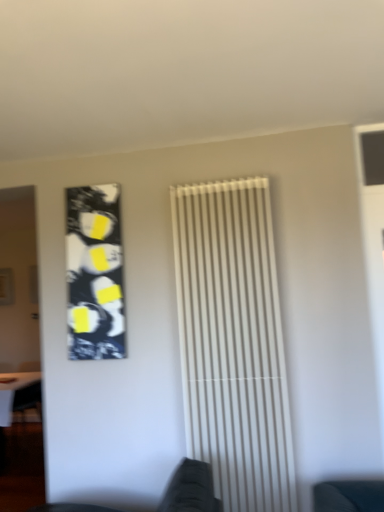
Image resolution: width=384 pixels, height=512 pixels. In order to click on white glossy table at lower left in this screenshot , I will do `click(18, 394)`.

The height and width of the screenshot is (512, 384). What do you see at coordinates (95, 273) in the screenshot? I see `black and white abstract art at upper left` at bounding box center [95, 273].

Image resolution: width=384 pixels, height=512 pixels. What are the coordinates of `white matte radiator at center` in the screenshot? It's located at pos(233,342).

Where is `poster that appears in front of the white glossy table at lower left`? poster that appears in front of the white glossy table at lower left is located at coordinates (95, 273).

Can you see black and white abstract art at upper left touching white glossy table at lower left?

No, black and white abstract art at upper left is not with white glossy table at lower left.

Which of these two, black and white abstract art at upper left or white glossy table at lower left, stands taller?

Standing taller between the two is black and white abstract art at upper left.

Would you say black and white abstract art at upper left is to the left or to the right of white glossy table at lower left in the picture?

Clearly, black and white abstract art at upper left is on the right of white glossy table at lower left in the image.

Based on the photo, is white glossy table at lower left surrounded by white matte radiator at center?

No, white glossy table at lower left is located outside of white matte radiator at center.

Is point (258, 336) closer or farther from the camera than point (5, 423)?

Point (258, 336) is positioned closer to the camera compared to point (5, 423).

Considering the relative sizes of white matte radiator at center and white glossy table at lower left in the image provided, is white matte radiator at center taller than white glossy table at lower left?

Yes, white matte radiator at center is taller than white glossy table at lower left.

Are white matte radiator at center and white glossy table at lower left far apart?

Indeed, white matte radiator at center is not near white glossy table at lower left.

From the image's perspective, relative to white matte radiator at center, is black and white abstract art at upper left above or below?

black and white abstract art at upper left is situated higher than white matte radiator at center in the image.

Does black and white abstract art at upper left turn towards white matte radiator at center?

No, black and white abstract art at upper left is not oriented towards white matte radiator at center.

Is black and white abstract art at upper left not within white matte radiator at center?

Yes, black and white abstract art at upper left is not within white matte radiator at center.

In the scene shown: Considering the sizes of white matte radiator at center and black and white abstract art at upper left in the image, is white matte radiator at center wider or thinner than black and white abstract art at upper left?

In the image, white matte radiator at center appears to be wider than black and white abstract art at upper left.

Is white matte radiator at center touching black and white abstract art at upper left?

No, white matte radiator at center is not with black and white abstract art at upper left.

This screenshot has height=512, width=384. I want to click on shutter below the black and white abstract art at upper left (from the image's perspective), so click(233, 342).

How many degrees apart are the facing directions of white glossy table at lower left and white matte radiator at center?

1.35 degrees separate the facing orientations of white glossy table at lower left and white matte radiator at center.

From the image's perspective, which is below, white glossy table at lower left or white matte radiator at center?

From the image's view, white glossy table at lower left is below.

Which is in front, point (40, 395) or point (253, 453)?

The point (253, 453) is closer to the camera.

Considering the relative sizes of white glossy table at lower left and white matte radiator at center in the image provided, is white glossy table at lower left smaller than white matte radiator at center?

No, white glossy table at lower left is not smaller than white matte radiator at center.

Considering the relative sizes of white glossy table at lower left and black and white abstract art at upper left in the image provided, is white glossy table at lower left wider than black and white abstract art at upper left?

Yes.

Considering the positions of point (14, 374) and point (114, 352), is point (14, 374) closer or farther from the camera than point (114, 352)?

Point (14, 374) is farther from the camera than point (114, 352).

Can you confirm if white glossy table at lower left is bigger than black and white abstract art at upper left?

Correct, white glossy table at lower left is larger in size than black and white abstract art at upper left.

Where is `poster that is in front of the white glossy table at lower left`? Image resolution: width=384 pixels, height=512 pixels. poster that is in front of the white glossy table at lower left is located at coordinates (95, 273).

There is a white glossy table at lower left. Where is `shutter above it (from a real-world perspective)`? The width and height of the screenshot is (384, 512). shutter above it (from a real-world perspective) is located at coordinates (233, 342).

Estimate the real-world distances between objects in this image. Which object is closer to white glossy table at lower left, black and white abstract art at upper left or white matte radiator at center?

black and white abstract art at upper left lies closer to white glossy table at lower left than the other object.

Based on their spatial positions, is white matte radiator at center or white glossy table at lower left closer to black and white abstract art at upper left?

The object closer to black and white abstract art at upper left is white matte radiator at center.

Based on their spatial positions, is white glossy table at lower left or white matte radiator at center further from black and white abstract art at upper left?

white glossy table at lower left.

Looking at the image, which one is located closer to white glossy table at lower left, white matte radiator at center or black and white abstract art at upper left?

black and white abstract art at upper left is positioned closer to the anchor white glossy table at lower left.

When comparing their distances from white matte radiator at center, does black and white abstract art at upper left or white glossy table at lower left seem closer?

black and white abstract art at upper left is positioned closer to the anchor white matte radiator at center.

From the image, which object appears to be nearer to white matte radiator at center, white glossy table at lower left or black and white abstract art at upper left?

The object closer to white matte radiator at center is black and white abstract art at upper left.

Where is `poster between white matte radiator at center and white glossy table at lower left in the front-back direction`? poster between white matte radiator at center and white glossy table at lower left in the front-back direction is located at coordinates (95, 273).